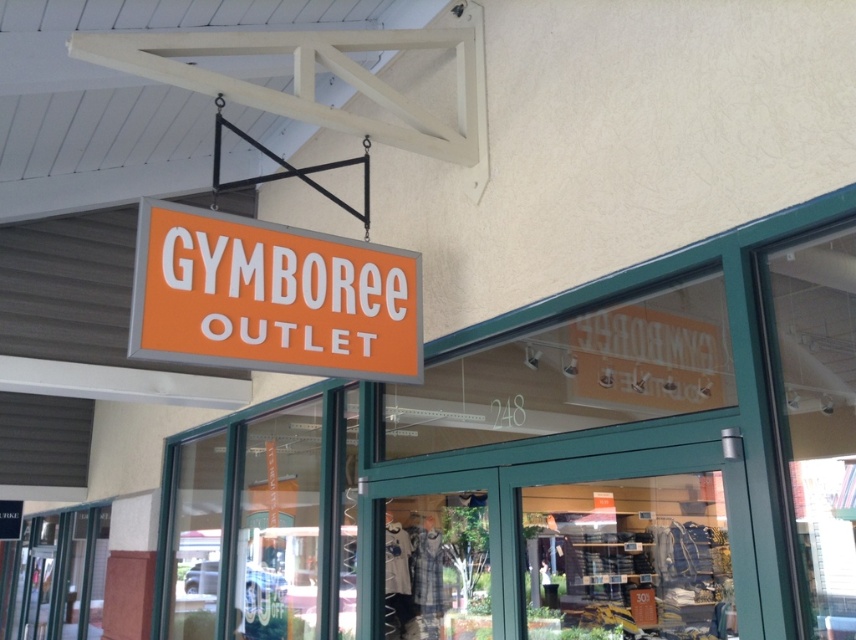
Can you confirm if orange matte sign at upper center is positioned below transparent glass door at center?

No, orange matte sign at upper center is not below transparent glass door at center.

Which is more to the right, orange matte sign at upper center or transparent glass door at center?

transparent glass door at center

Who is more forward, [376,256] or [604,628]?

Point [376,256] is in front.

The width and height of the screenshot is (856, 640). Find the location of `orange matte sign at upper center`. orange matte sign at upper center is located at coordinates (271, 298).